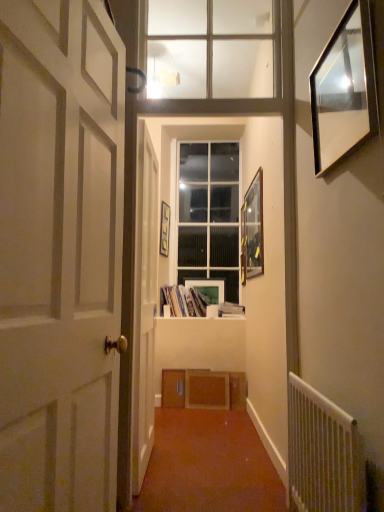
Question: Which direction should I rotate to look at white wooden door at center, which appears as the 1th door when viewed from the back?

Choices:
 (A) right
 (B) left

Answer: (B)

Question: In which direction should I rotate to look at matte white picture frame at center, the third picture frame when ordered from right to left?

Choices:
 (A) left
 (B) right

Answer: (B)

Question: Does white wooden door at center, which is the second door in front-to-back order, lie in front of matte paper books at center, arranged as the second book when viewed from the right?

Choices:
 (A) no
 (B) yes

Answer: (B)

Question: Is white wooden door at center, which is the second door in front-to-back order, bigger than matte paper books at center, arranged as the second book when viewed from the right?

Choices:
 (A) no
 (B) yes

Answer: (B)

Question: Does white wooden door at center, which appears as the 1th door when viewed from the back, have a greater height compared to matte paper books at center, arranged as the second book when viewed from the right?

Choices:
 (A) yes
 (B) no

Answer: (A)

Question: Does white wooden door at center, which appears as the 1th door when viewed from the back, appear on the left side of matte paper books at center, the 1th book viewed from the left?

Choices:
 (A) yes
 (B) no

Answer: (A)

Question: Is white wooden door at center, which is the second door in front-to-back order, wider than matte paper books at center, arranged as the second book when viewed from the right?

Choices:
 (A) yes
 (B) no

Answer: (B)

Question: Is white wooden door at center, which is the second door in front-to-back order, oriented away from matte paper books at center, the 1th book viewed from the left?

Choices:
 (A) yes
 (B) no

Answer: (B)

Question: Does wooden picture frame at center, placed as the first picture frame when sorted from left to right, appear on the left side of matte paper books at center, the 1th book viewed from the left?

Choices:
 (A) yes
 (B) no

Answer: (A)

Question: Is wooden picture frame at center, which is the 2th picture frame in back-to-front order, to the right of matte paper books at center, the 1th book viewed from the left, from the viewer's perspective?

Choices:
 (A) yes
 (B) no

Answer: (B)

Question: Considering the relative sizes of wooden picture frame at center, placed as the first picture frame when sorted from left to right, and matte paper books at center, the 1th book viewed from the left, in the image provided, is wooden picture frame at center, placed as the first picture frame when sorted from left to right, taller than matte paper books at center, the 1th book viewed from the left,?

Choices:
 (A) yes
 (B) no

Answer: (A)

Question: Does wooden picture frame at center, which is the 2th picture frame in back-to-front order, have a larger size compared to matte paper books at center, the 1th book viewed from the left?

Choices:
 (A) no
 (B) yes

Answer: (A)

Question: Would you consider wooden picture frame at center, which is the third picture frame in front-to-back order, to be distant from matte paper books at center, arranged as the second book when viewed from the right?

Choices:
 (A) no
 (B) yes

Answer: (A)

Question: Considering the relative sizes of wooden picture frame at center, which is counted as the 4th picture frame, starting from the right, and matte paper books at center, the 1th book viewed from the left, in the image provided, is wooden picture frame at center, which is counted as the 4th picture frame, starting from the right, wider than matte paper books at center, the 1th book viewed from the left,?

Choices:
 (A) yes
 (B) no

Answer: (B)

Question: Considering the relative positions of white painted wood door at left, which is the first door from front to back, and white metal radiator at lower right in the image provided, is white painted wood door at left, which is the first door from front to back, in front of white metal radiator at lower right?

Choices:
 (A) yes
 (B) no

Answer: (A)